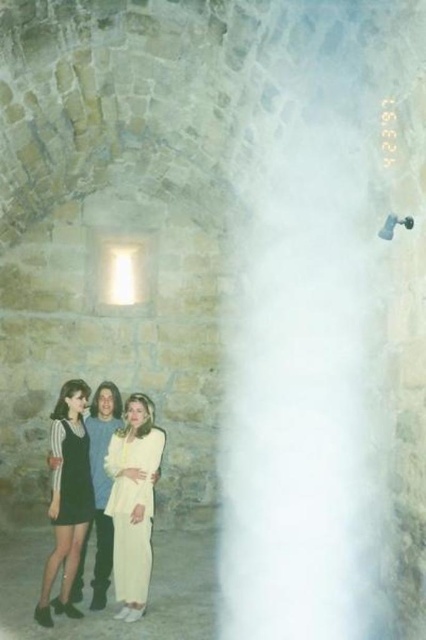
You are a photographer setting up for a shoot in this dimly lit tunnel. You have two dresses to photograph, the matte black dress at left and the black satin dress at left. Since the only light source is on the left, which dress should you position closer to the light to ensure better visibility?

The matte black dress at left should be positioned closer to the light source on the left because it is already to the left of the black satin dress at left, making it naturally closer to the light, thus ensuring better visibility.

You are standing in a dimly lit stone tunnel with two dresses visible. The light yellow fabric dress at center and the black satin dress at left. Which dress is nearer to you?

The light yellow fabric dress at center is closer to the viewer than the black satin dress at left, so the light yellow fabric dress at center is nearer to you.